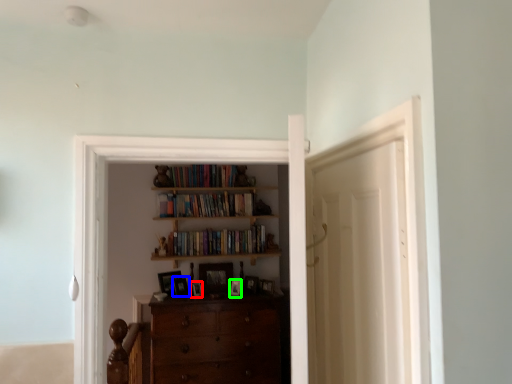
Question: Based on their relative distances, which object is nearer to picture frame (highlighted by a red box)? Choose from picture frame (highlighted by a blue box) and picture frame (highlighted by a green box).

Choices:
 (A) picture frame
 (B) picture frame

Answer: (A)